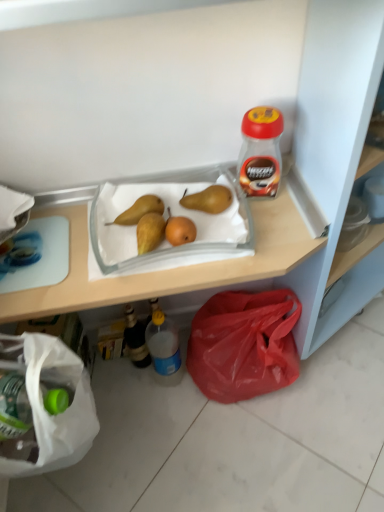
Identify the location of vacant space to the left of translucent plastic bottle at lower center, which ranks as the 1th bottle in bottom-to-top order. (123, 387).